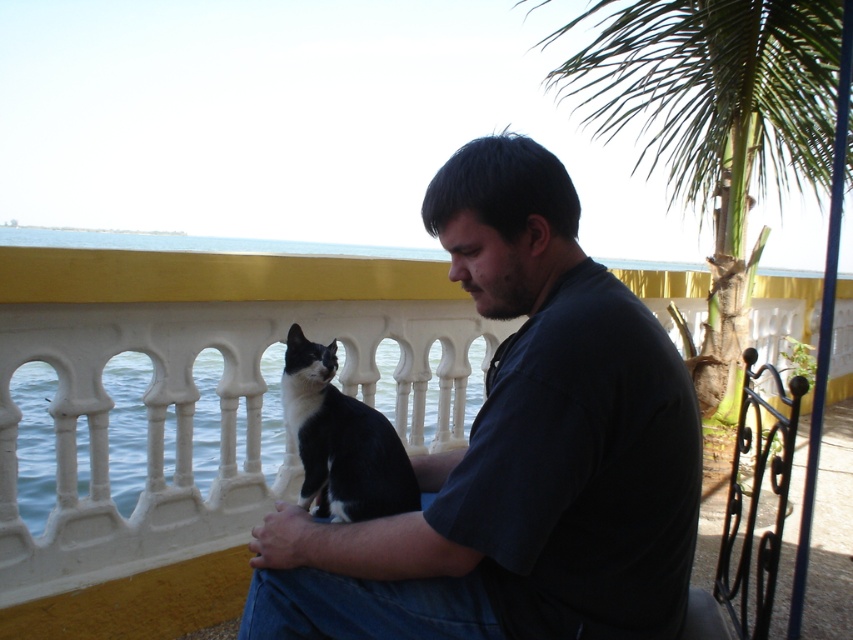
You are a photographer trying to capture the man and his cat on the balcony. Since you want to ensure both subjects are in focus, you need to know which one is taller. Which is taller, the dark blue shirt at center or the black fur cat at center?

The dark blue shirt at center is taller than the black fur cat at center.

You are a delivery robot with a 0.5 meter wide package. You need to place the package between the dark blue shirt at center and the yellow section of the balcony railing. Is there enough space?

The distance between the dark blue shirt at center and the yellow section of the balcony railing is 1.13 meters. Since the package is 0.5 meters wide, there is sufficient space to place it between them.